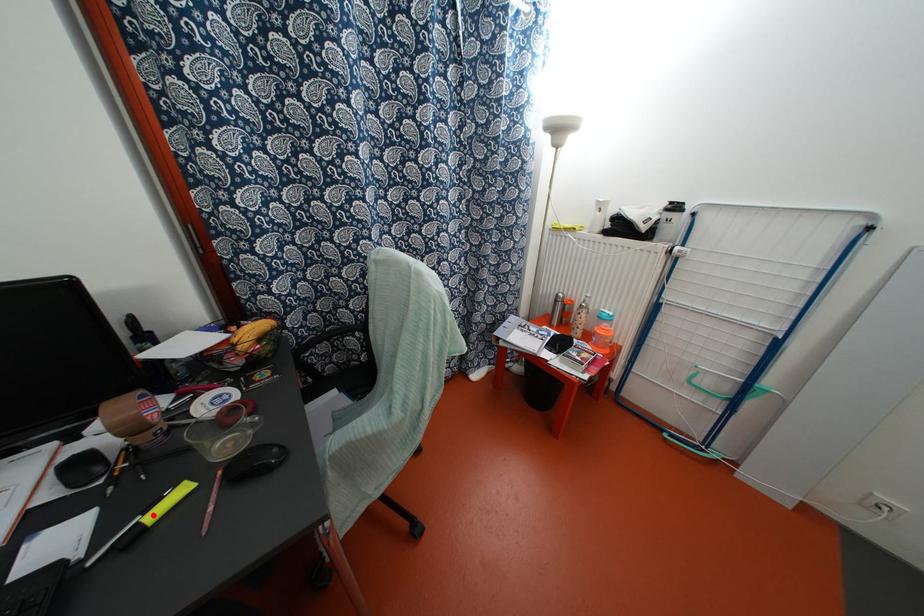
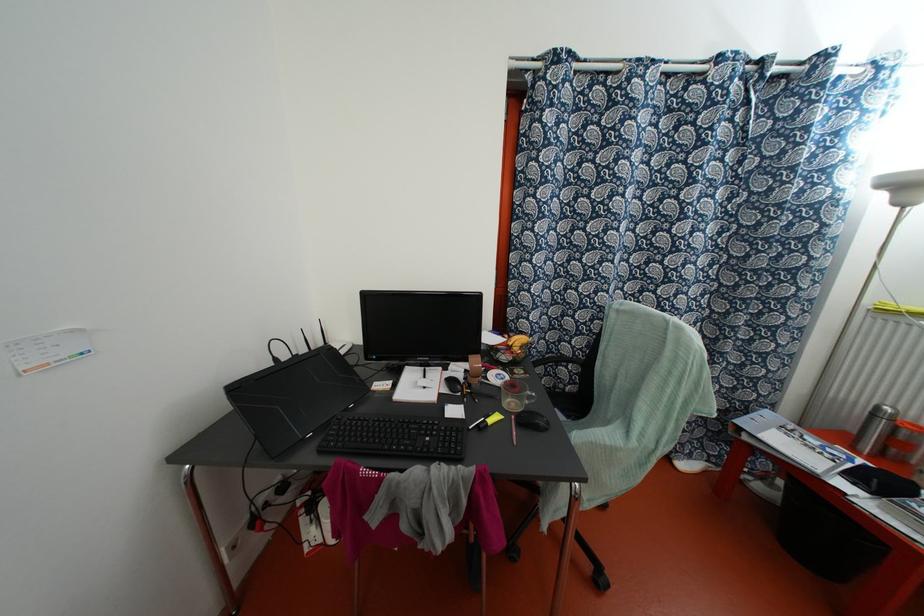
The point at the highlighted location is marked in the first image. Where is the corresponding point in the second image?

(489, 421)